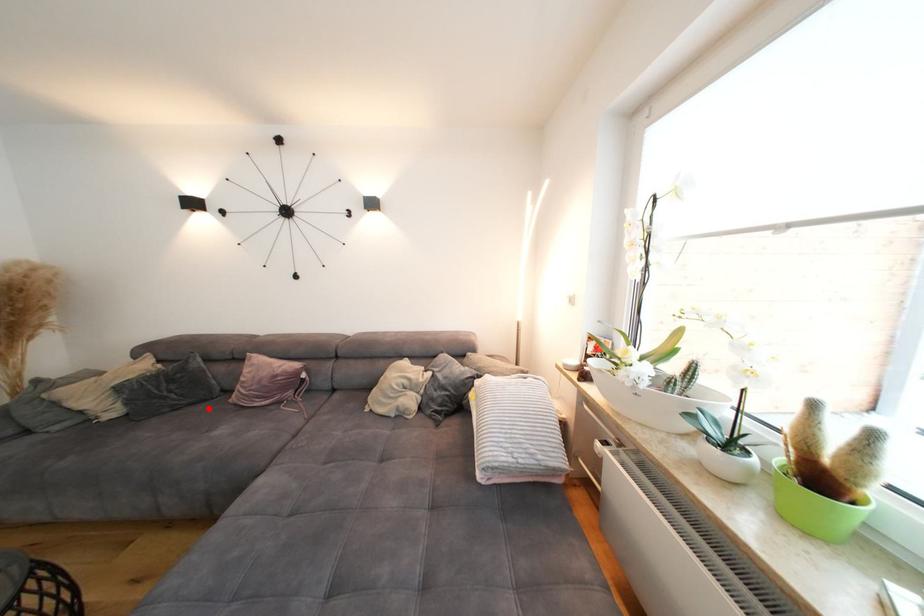
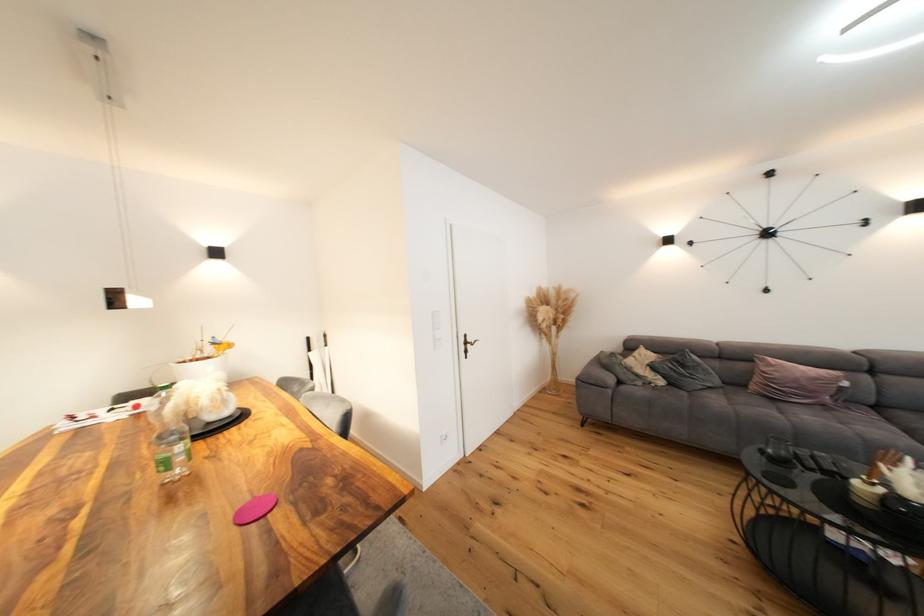
Find the pixel in the second image that matches the highlighted location in the first image.

(727, 392)